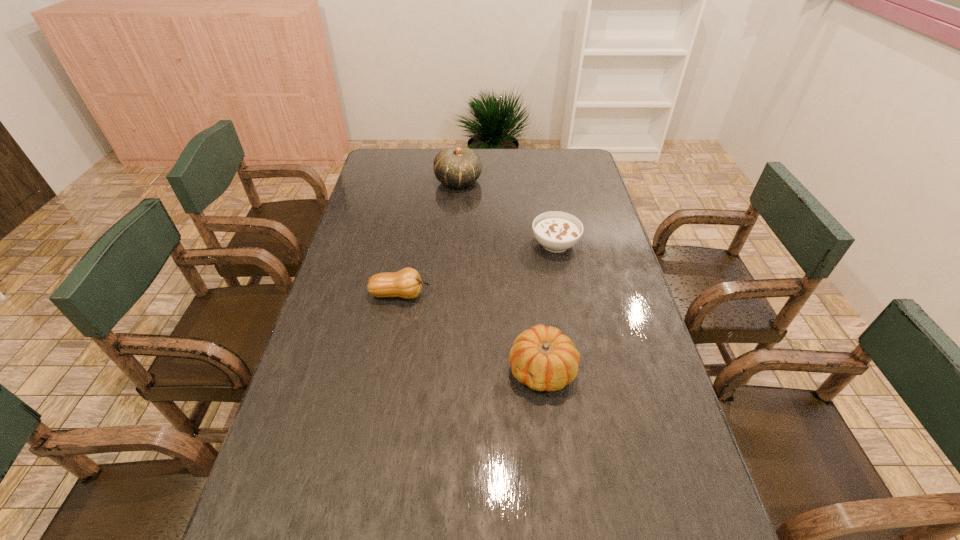
Locate an element on the screen. The height and width of the screenshot is (540, 960). the farthest gourd is located at coordinates (457, 167).

Image resolution: width=960 pixels, height=540 pixels. I want to click on the tallest gourd, so click(457, 167).

Where is `the rightmost gourd`? the rightmost gourd is located at coordinates (544, 359).

This screenshot has height=540, width=960. In order to click on the nearest gourd in this screenshot , I will do `click(544, 359)`.

The height and width of the screenshot is (540, 960). I want to click on the third farthest object, so click(x=406, y=283).

Identify the location of the shortest gourd. (406, 283).

Identify the location of soup bowl. (556, 231).

Where is `the shortest object`? This screenshot has width=960, height=540. the shortest object is located at coordinates (556, 231).

Locate an element on the screen. vacant space located 0.110m on the left of the farthest object is located at coordinates (407, 181).

Where is `blank area located 0.260m on the back of the rightmost gourd`? The width and height of the screenshot is (960, 540). blank area located 0.260m on the back of the rightmost gourd is located at coordinates (531, 275).